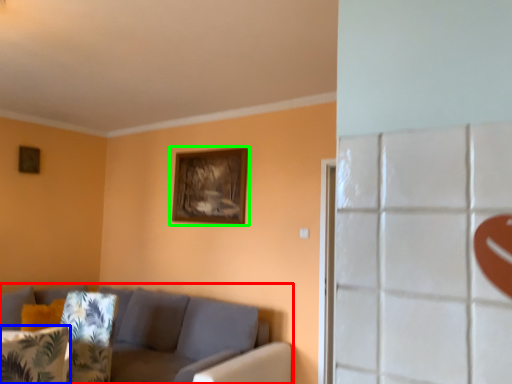
Question: Which object is the farthest from studio couch (highlighted by a red box)? Choose among these: pillow (highlighted by a blue box) or picture frame (highlighted by a green box).

Choices:
 (A) pillow
 (B) picture frame

Answer: (A)